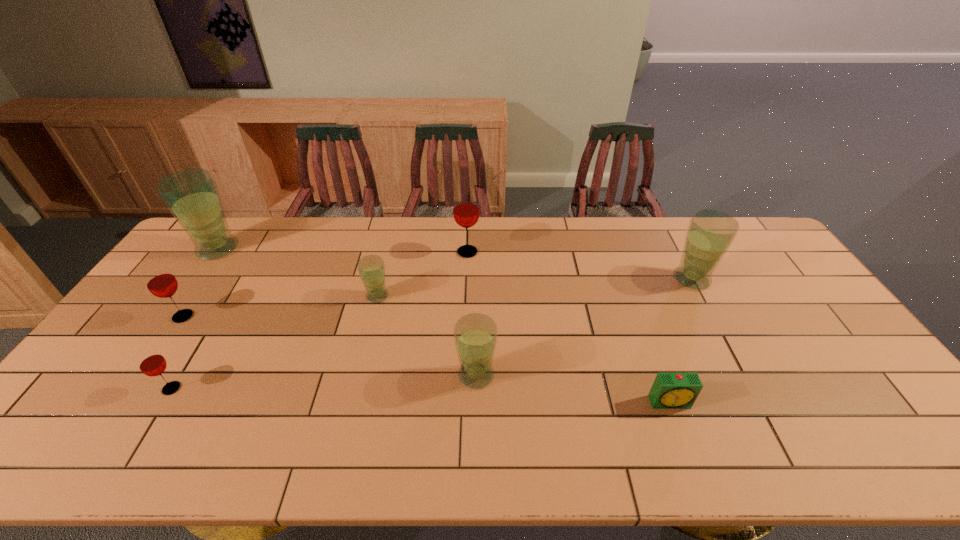
This screenshot has width=960, height=540. I want to click on the leftmost blue glass, so click(x=191, y=195).

Locate an element on the screen. This screenshot has height=540, width=960. the biggest blue glass is located at coordinates tap(191, 195).

Image resolution: width=960 pixels, height=540 pixels. I want to click on the farthest red glass, so click(x=466, y=211).

The height and width of the screenshot is (540, 960). In order to click on the biggest red glass in this screenshot , I will do `click(466, 211)`.

Locate an element on the screen. The width and height of the screenshot is (960, 540). the rightmost object is located at coordinates tap(710, 233).

Image resolution: width=960 pixels, height=540 pixels. Identify the location of the rightmost blue glass. point(710,233).

This screenshot has width=960, height=540. What are the coordinates of `the leftmost red glass` in the screenshot? It's located at (160, 281).

This screenshot has height=540, width=960. I want to click on the second nearest red glass, so click(160, 281).

The width and height of the screenshot is (960, 540). I want to click on the nearest blue glass, so point(475,335).

Identify the location of the third blue glass from left to right. The width and height of the screenshot is (960, 540). (475, 335).